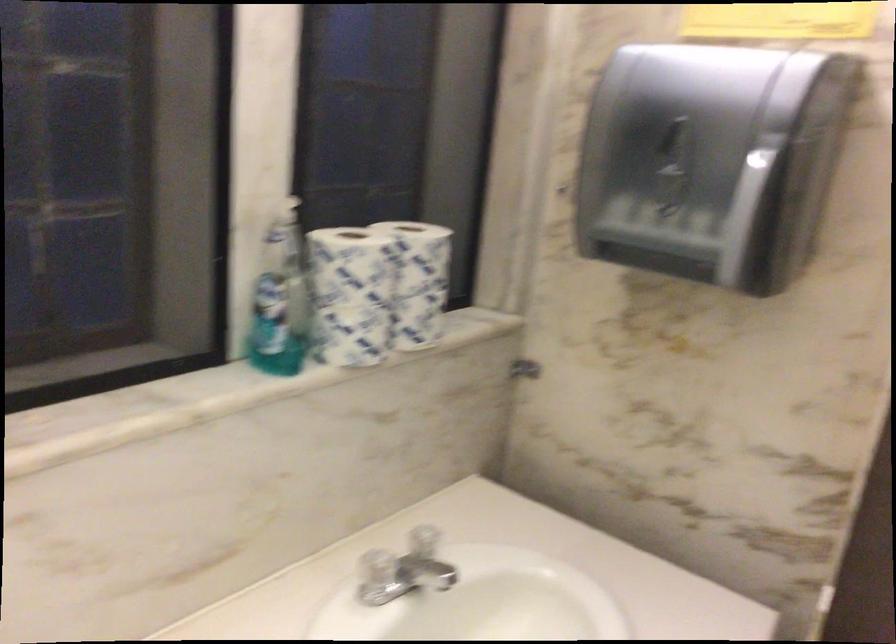
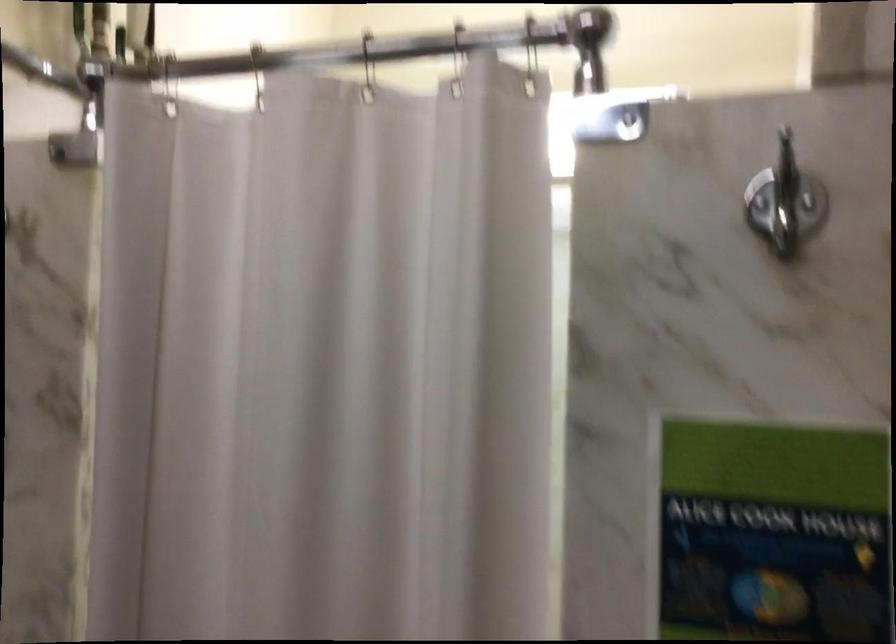
Question: How did the camera likely rotate?

Choices:
 (A) Left
 (B) Right
 (C) Up
 (D) Down

Answer: (B)